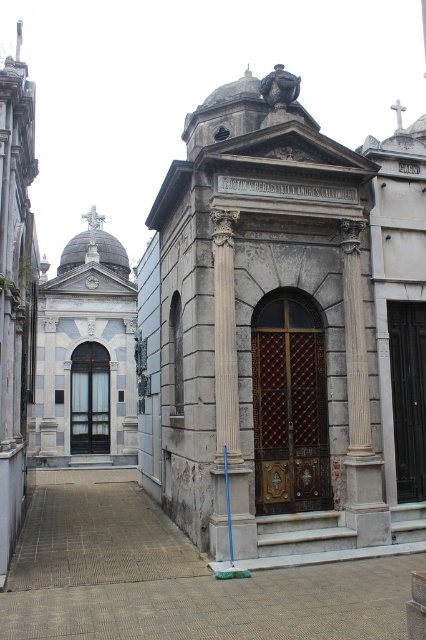
Question: From the image, what is the correct spatial relationship of dark brown wooden door at center in relation to matte glass door at center?

Choices:
 (A) below
 (B) above

Answer: (B)

Question: Estimate the real-world distances between objects in this image. Which object is farther from the dark brown wooden door at center?

Choices:
 (A) stone/concrete mausoleum at center
 (B) white stone column at center
 (C) white marble column at center
 (D) matte glass door at center

Answer: (D)

Question: Which is farther from the white marble column at center?

Choices:
 (A) stone/concrete mausoleum at center
 (B) white stone column at center
 (C) matte glass door at center
 (D) smooth gray stone church at left

Answer: (C)

Question: Is stone/concrete mausoleum at center smaller than matte glass door at center?

Choices:
 (A) yes
 (B) no

Answer: (B)

Question: In this image, where is white stone column at center located relative to dark brown wooden door at center?

Choices:
 (A) above
 (B) below

Answer: (B)

Question: Estimate the real-world distances between objects in this image. Which object is farther from the smooth gray stone church at left?

Choices:
 (A) white marble column at center
 (B) white stone column at center

Answer: (B)